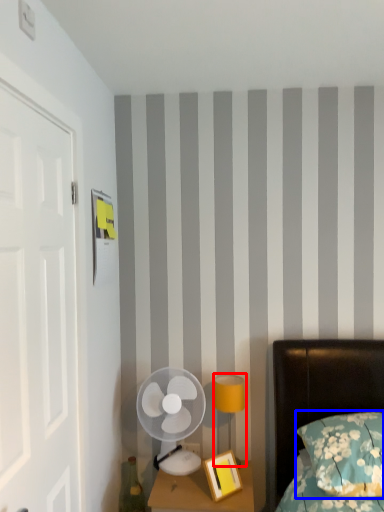
Question: Among these objects, which one is nearest to the camera, bedside lamp (highlighted by a red box) or pillow (highlighted by a blue box)?

Choices:
 (A) bedside lamp
 (B) pillow

Answer: (B)